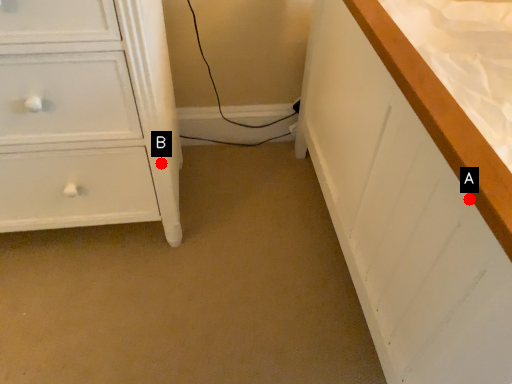
Question: Two points are circled on the image, labeled by A and B beside each circle. Which point is farther to the camera?

Choices:
 (A) A is further
 (B) B is further

Answer: (B)